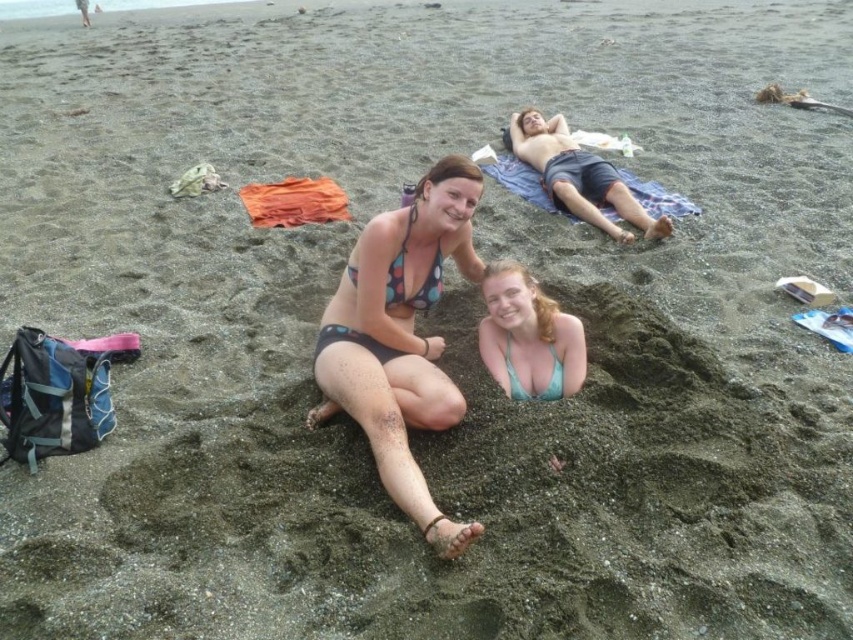
Question: Is polka dot bikini bottom at center bigger than teal fabric bikini top at center?

Choices:
 (A) no
 (B) yes

Answer: (B)

Question: Among these points, which one is farthest from the camera?

Choices:
 (A) (521, 275)
 (B) (421, 220)

Answer: (A)

Question: Can you confirm if polka dot bikini bottom at center is smaller than teal fabric bikini top at center?

Choices:
 (A) no
 (B) yes

Answer: (A)

Question: Does polka dot bikini bottom at center have a larger size compared to teal fabric bikini top at center?

Choices:
 (A) yes
 (B) no

Answer: (A)